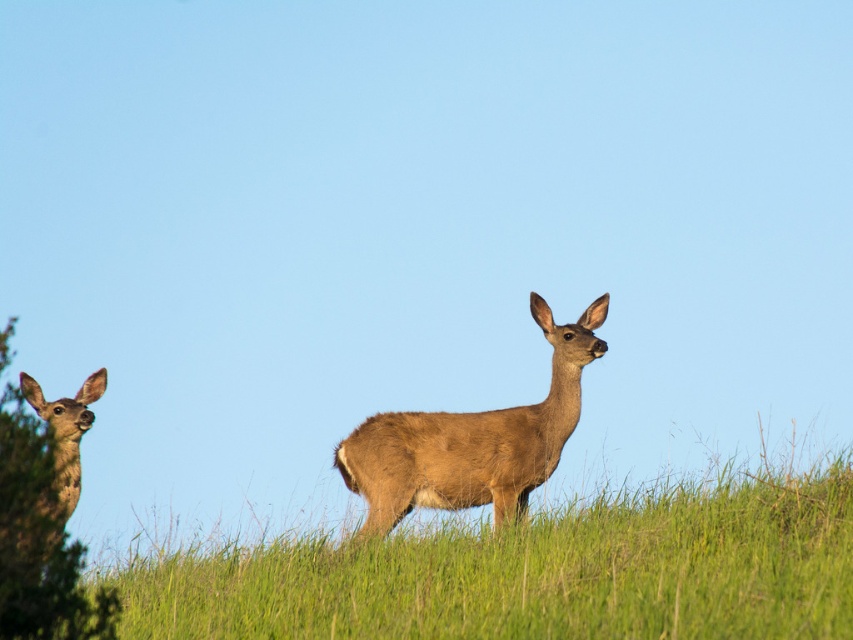
Question: Does green grass at center appear over brown fuzzy deer at left?

Choices:
 (A) yes
 (B) no

Answer: (B)

Question: Which is nearer to the brown fuzzy deer at left?

Choices:
 (A) brown matte/deer at center
 (B) green grass at center

Answer: (A)

Question: Among these objects, which one is nearest to the camera?

Choices:
 (A) brown fuzzy deer at left
 (B) green grass at center

Answer: (B)

Question: Is brown matte/deer at center to the right of brown fuzzy deer at left from the viewer's perspective?

Choices:
 (A) yes
 (B) no

Answer: (A)

Question: Which point is closer to the camera?

Choices:
 (A) green grass at center
 (B) brown fuzzy deer at left

Answer: (A)

Question: Is brown matte/deer at center positioned behind brown fuzzy deer at left?

Choices:
 (A) yes
 (B) no

Answer: (B)